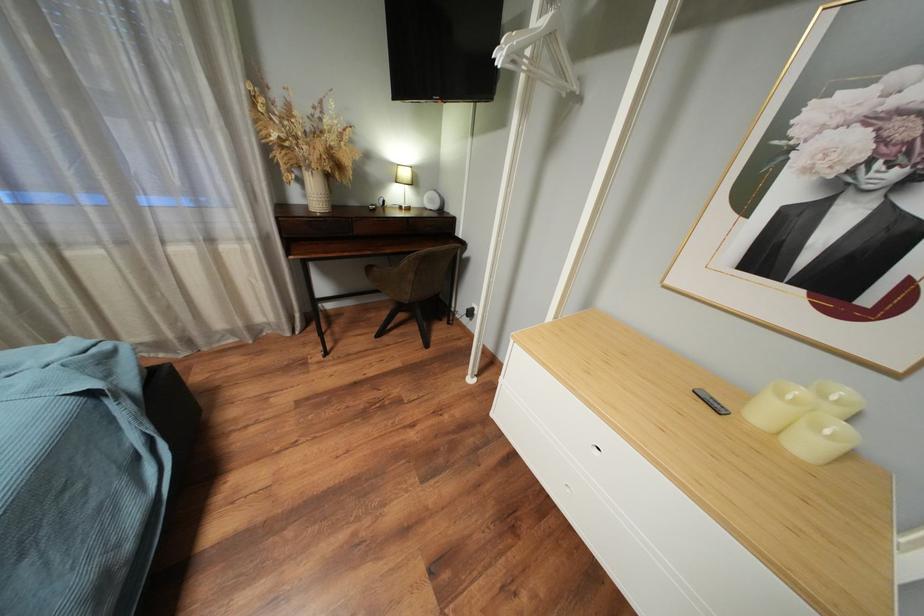
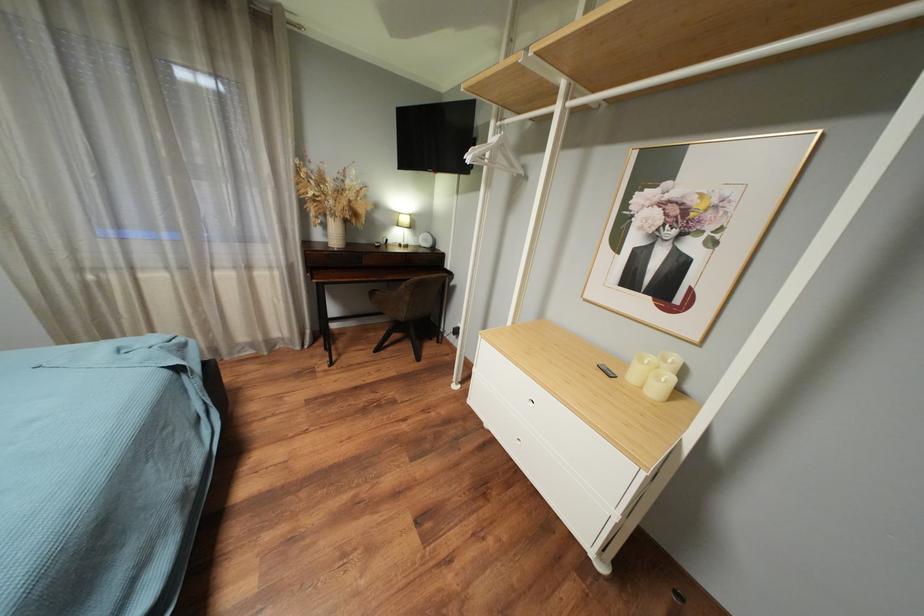
Question: The images are taken continuously from a first-person perspective. In which direction are you moving?

Choices:
 (A) Left
 (B) Right
 (C) Forward
 (D) Backward

Answer: (D)